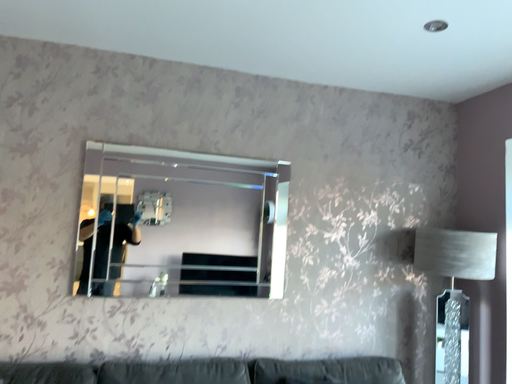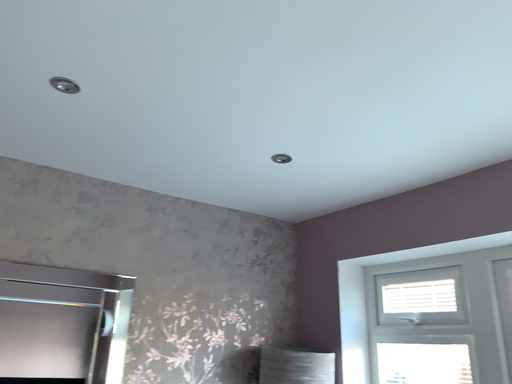
Question: Which way did the camera rotate in the video?

Choices:
 (A) rotated downward
 (B) rotated upward

Answer: (B)